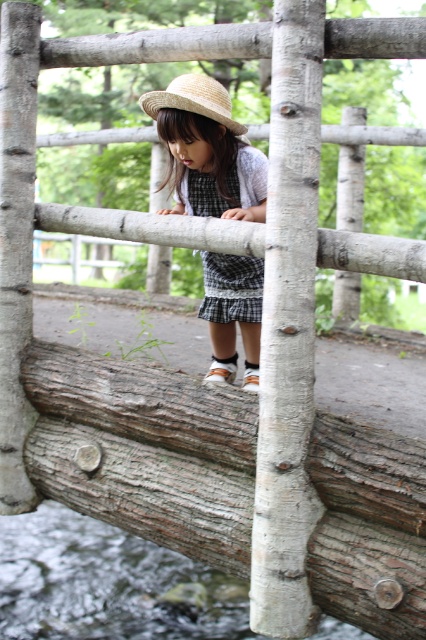
Question: Does brown rough wood log at center have a larger size compared to straw hat at center?

Choices:
 (A) no
 (B) yes

Answer: (B)

Question: Considering the real-world distances, which object is farthest from the clear water at lower left?

Choices:
 (A) strawmaterial/texturehat at upper center
 (B) straw hat at center
 (C) checkered fabric dress at center

Answer: (A)

Question: Does straw hat at center have a smaller size compared to checkered fabric dress at center?

Choices:
 (A) yes
 (B) no

Answer: (B)

Question: Which point is closer to the camera?

Choices:
 (A) (226, 186)
 (B) (88, 497)
 (C) (203, 301)

Answer: (A)

Question: Which of the following is the farthest from the observer?

Choices:
 (A) (371, 620)
 (B) (201, 96)
 (C) (244, 628)
 (D) (207, 266)

Answer: (C)

Question: Does clear water at lower left appear over strawmaterial/texturehat at upper center?

Choices:
 (A) no
 (B) yes

Answer: (A)